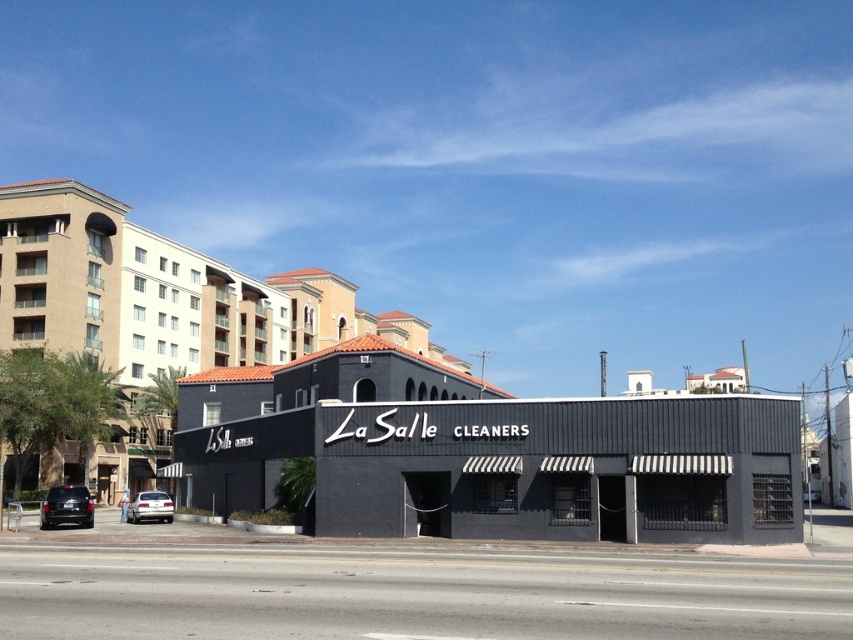
Question: Does beige stucco building at left have a greater width compared to shiny black suv at lower left?

Choices:
 (A) no
 (B) yes

Answer: (B)

Question: Does matte black building at center appear over silver metallic sedan at lower left?

Choices:
 (A) yes
 (B) no

Answer: (A)

Question: Does matte black building at center come behind beige stucco building at left?

Choices:
 (A) no
 (B) yes

Answer: (A)

Question: Which of the following is the closest to the observer?

Choices:
 (A) matte black building at center
 (B) beige stucco building at left
 (C) silver metallic sedan at lower left
 (D) shiny black suv at lower left

Answer: (A)

Question: Which object is the farthest from the beige stucco building at left?

Choices:
 (A) matte black building at center
 (B) silver metallic sedan at lower left
 (C) shiny black suv at lower left

Answer: (C)

Question: Which of the following is the farthest from the observer?

Choices:
 (A) beige stucco building at left
 (B) matte black building at center

Answer: (A)